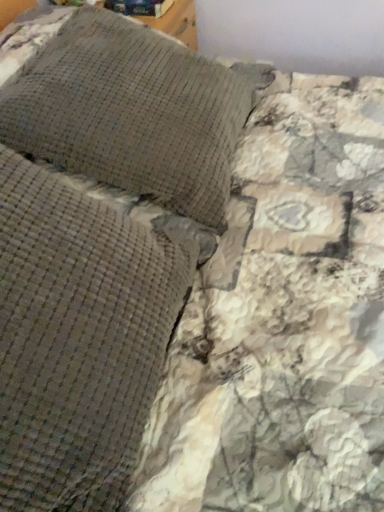
Question: Should I look upward or downward to see woven fabric pillow at upper left, acting as the first pillow starting from the back?

Choices:
 (A) down
 (B) up

Answer: (B)

Question: Considering the relative sizes of woven fabric pillow at upper left, which ranks as the first pillow in front-to-back order, and woven fabric pillow at upper left, the second pillow when ordered from front to back, in the image provided, is woven fabric pillow at upper left, which ranks as the first pillow in front-to-back order, bigger than woven fabric pillow at upper left, the second pillow when ordered from front to back,?

Choices:
 (A) no
 (B) yes

Answer: (A)

Question: Can woven fabric pillow at upper left, acting as the first pillow starting from the back, be found inside woven fabric pillow at upper left, positioned as the 2th pillow in back-to-front order?

Choices:
 (A) yes
 (B) no

Answer: (B)

Question: Is woven fabric pillow at upper left, positioned as the 2th pillow in back-to-front order, placed right next to woven fabric pillow at upper left, the second pillow when ordered from front to back?

Choices:
 (A) yes
 (B) no

Answer: (B)

Question: Considering the relative sizes of woven fabric pillow at upper left, which ranks as the first pillow in front-to-back order, and woven fabric pillow at upper left, the second pillow when ordered from front to back, in the image provided, is woven fabric pillow at upper left, which ranks as the first pillow in front-to-back order, thinner than woven fabric pillow at upper left, the second pillow when ordered from front to back,?

Choices:
 (A) yes
 (B) no

Answer: (A)

Question: From a real-world perspective, is woven fabric pillow at upper left, which ranks as the first pillow in front-to-back order, on top of woven fabric pillow at upper left, acting as the first pillow starting from the back?

Choices:
 (A) yes
 (B) no

Answer: (A)

Question: Is woven fabric pillow at upper left, which ranks as the first pillow in front-to-back order, closer to camera compared to woven fabric pillow at upper left, acting as the first pillow starting from the back?

Choices:
 (A) no
 (B) yes

Answer: (B)

Question: Can you confirm if woven fabric pillow at upper left, acting as the first pillow starting from the back, is shorter than woven fabric pillow at upper left, which ranks as the first pillow in front-to-back order?

Choices:
 (A) yes
 (B) no

Answer: (B)

Question: Does woven fabric pillow at upper left, acting as the first pillow starting from the back, come behind woven fabric pillow at upper left, which ranks as the first pillow in front-to-back order?

Choices:
 (A) no
 (B) yes

Answer: (B)

Question: Does woven fabric pillow at upper left, the second pillow when ordered from front to back, have a larger size compared to woven fabric pillow at upper left, which ranks as the first pillow in front-to-back order?

Choices:
 (A) no
 (B) yes

Answer: (B)

Question: Is woven fabric pillow at upper left, acting as the first pillow starting from the back, completely or partially outside of woven fabric pillow at upper left, which ranks as the first pillow in front-to-back order?

Choices:
 (A) no
 (B) yes

Answer: (B)

Question: Is woven fabric pillow at upper left, acting as the first pillow starting from the back, at the right side of woven fabric pillow at upper left, positioned as the 2th pillow in back-to-front order?

Choices:
 (A) no
 (B) yes

Answer: (B)

Question: From a real-world perspective, is woven fabric pillow at upper left, the second pillow when ordered from front to back, positioned under woven fabric pillow at upper left, positioned as the 2th pillow in back-to-front order, based on gravity?

Choices:
 (A) no
 (B) yes

Answer: (B)

Question: Considering the positions of woven fabric pillow at upper left, positioned as the 2th pillow in back-to-front order, and woven fabric pillow at upper left, the second pillow when ordered from front to back, in the image, is woven fabric pillow at upper left, positioned as the 2th pillow in back-to-front order, bigger or smaller than woven fabric pillow at upper left, the second pillow when ordered from front to back,?

Choices:
 (A) big
 (B) small

Answer: (B)